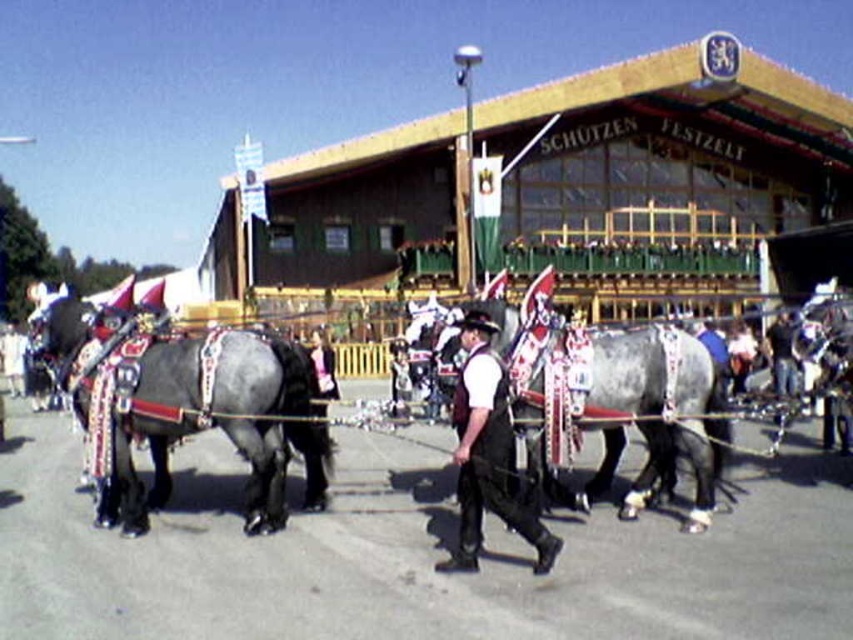
You are a photographer standing in front of the SCHUETZEN FESTZELT tent. You want to take a photo of both the shiny black horse at center and the gray glossy horse at center. Which horse should you focus on first to ensure both are in sharp focus?

You should focus on the shiny black horse at center first because it is closer to the viewer than the gray glossy horse at center. By focusing on the closer horse, the farther one will also be in focus due to the depth of field.

You are standing in front of the Shooting Festival Tent and want to take a photo of the shiny black horse at center. If your camera has a maximum focus range of 8 meters, will you be able to capture the horse clearly?

The shiny black horse at center is 8.05 meters away from the viewer. Since the camera can only focus up to 8 meters, it will be slightly out of range, so the photo may not be clear.